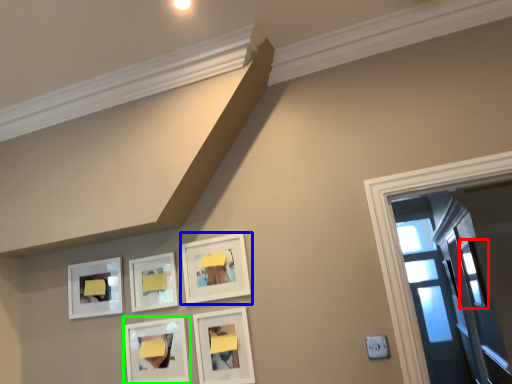
Question: Estimate the real-world distances between objects in this image. Which object is farther from window (highlighted by a red box), picture frame (highlighted by a blue box) or picture frame (highlighted by a green box)?

Choices:
 (A) picture frame
 (B) picture frame

Answer: (B)